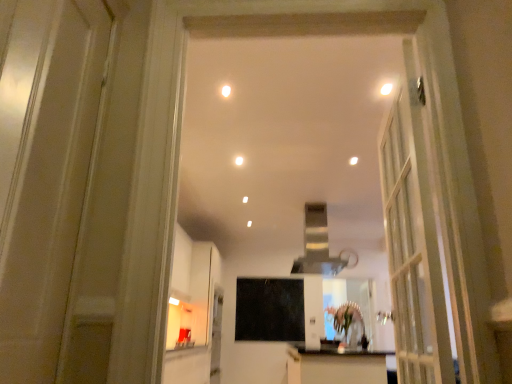
Question: Is the depth of green matte flower at center greater than that of white glossy light fixture at upper center, marked as the first lighting in a left-to-right arrangement?

Choices:
 (A) yes
 (B) no

Answer: (A)

Question: From a real-world perspective, is green matte flower at center under white glossy light fixture at upper center, the 2th lighting from the right?

Choices:
 (A) yes
 (B) no

Answer: (A)

Question: Does green matte flower at center have a smaller size compared to white glossy light fixture at upper center, the 2th lighting from the right?

Choices:
 (A) no
 (B) yes

Answer: (A)

Question: Does green matte flower at center have a lesser height compared to white glossy light fixture at upper center, the 2th lighting from the right?

Choices:
 (A) yes
 (B) no

Answer: (B)

Question: Can you confirm if green matte flower at center is positioned to the left of white glossy light fixture at upper center, marked as the first lighting in a left-to-right arrangement?

Choices:
 (A) yes
 (B) no

Answer: (B)

Question: Is there a large distance between green matte flower at center and white glossy light fixture at upper center, the 2th lighting from the right?

Choices:
 (A) no
 (B) yes

Answer: (B)

Question: Is white glossy light fixture at upper center, the 2th lighting from the right, to the right of white glossy light fixture at upper center, acting as the first lighting starting from the right, from the viewer's perspective?

Choices:
 (A) no
 (B) yes

Answer: (A)

Question: Is white glossy light fixture at upper center, marked as the first lighting in a left-to-right arrangement, not near white glossy light fixture at upper center, acting as the first lighting starting from the right?

Choices:
 (A) yes
 (B) no

Answer: (B)

Question: Does white glossy light fixture at upper center, marked as the first lighting in a left-to-right arrangement, turn towards white glossy light fixture at upper center, acting as the first lighting starting from the right?

Choices:
 (A) no
 (B) yes

Answer: (B)

Question: Is white glossy light fixture at upper center, placed as the second lighting when sorted from left to right, a part of white glossy light fixture at upper center, the 2th lighting from the right?

Choices:
 (A) no
 (B) yes

Answer: (A)

Question: Does white glossy light fixture at upper center, the 2th lighting from the right, lie behind white glossy light fixture at upper center, placed as the second lighting when sorted from left to right?

Choices:
 (A) yes
 (B) no

Answer: (A)

Question: From a real-world perspective, is white glossy light fixture at upper center, marked as the first lighting in a left-to-right arrangement, under white glossy light fixture at upper center, acting as the first lighting starting from the right?

Choices:
 (A) no
 (B) yes

Answer: (A)

Question: Is clear glass mirror at center surrounding white glossy door at left?

Choices:
 (A) yes
 (B) no

Answer: (B)